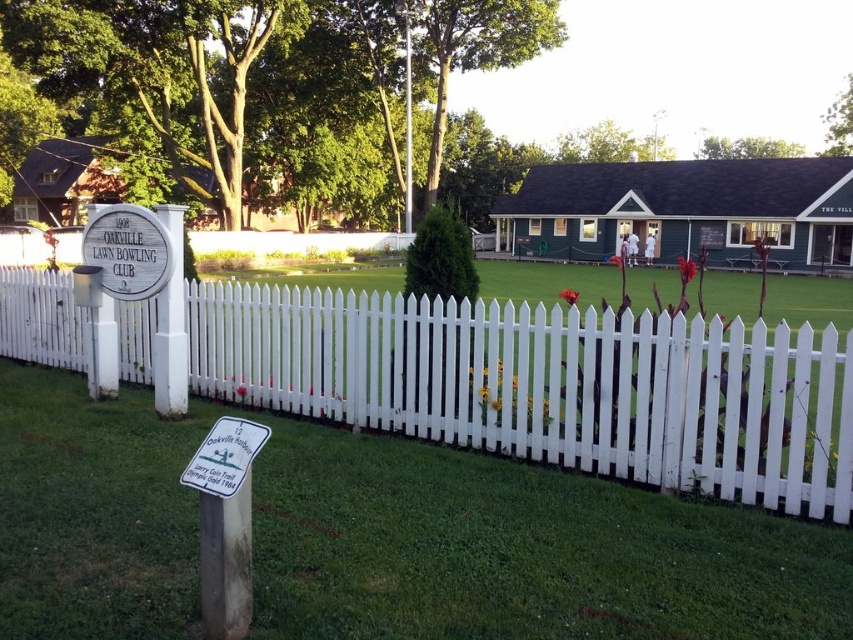
You are standing at the point marked by the coordinates (378, 538) in the image. What do you see directly in front of you?

At the coordinates (378, 538), you would see green grass at center, which is the focal point of the scene surrounded by the white picket fence.